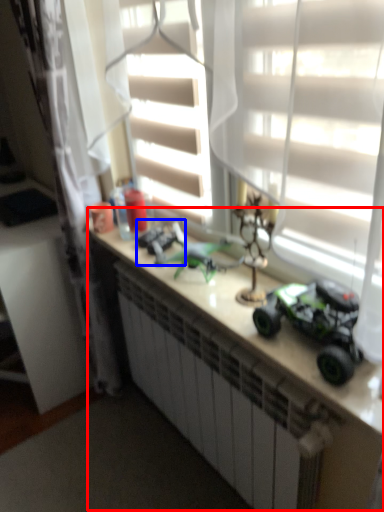
Question: Which object is closer to the camera taking this photo, counter (highlighted by a red box) or toy (highlighted by a blue box)?

Choices:
 (A) counter
 (B) toy

Answer: (A)